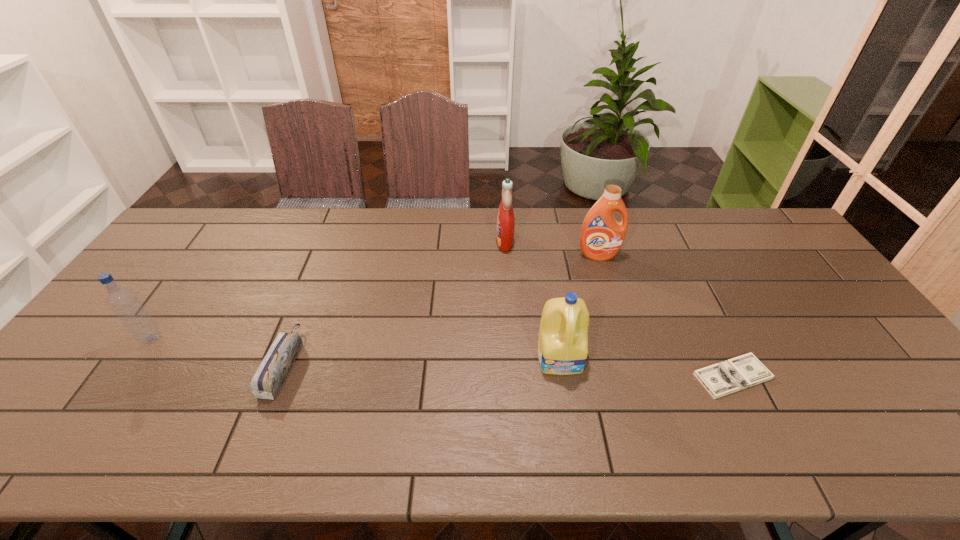
Locate which object ranks fourth in proximity to the fifth tallest object. Please provide its 2D coordinates. Your answer should be formatted as a tuple, i.e. [(x, y)], where the tuple contains the x and y coordinates of a point satisfying the conditions above.

[(601, 238)]

Find the location of a particular element. Image resolution: width=960 pixels, height=540 pixels. object that is the closest one to the fifth object from left to right is located at coordinates (505, 226).

You are a GUI agent. You are given a task and a screenshot of the screen. Output one action in this format:
    pyautogui.click(x=<x>, y=<y>)
    Task: Click on the detergent that stands as the closest to the fifth object from left to right
    The width and height of the screenshot is (960, 540).
    Given the screenshot: What is the action you would take?
    pyautogui.click(x=505, y=226)

At what (x,y) coordinates should I click in order to perform the action: click on the closest detergent relative to the nearest detergent. Please return your answer as a coordinate pair (x, y). Looking at the image, I should click on (601, 238).

This screenshot has height=540, width=960. I want to click on vacant space that satisfies the following two spatial constraints: 1. on the front-facing side of the shortest object; 2. on the left side of the fifth object from left to right, so coord(636,376).

You are a GUI agent. You are given a task and a screenshot of the screen. Output one action in this format:
    pyautogui.click(x=<x>, y=<y>)
    Task: Click on the free space that satisfies the following two spatial constraints: 1. on the front-facing side of the rightmost detergent; 2. on the left side of the shortest object
    The height and width of the screenshot is (540, 960).
    Given the screenshot: What is the action you would take?
    pyautogui.click(x=636, y=376)

This screenshot has height=540, width=960. In order to click on vacant position in the image that satisfies the following two spatial constraints: 1. on the label of the nearest detergent; 2. on the right side of the dollar in this screenshot , I will do `click(564, 376)`.